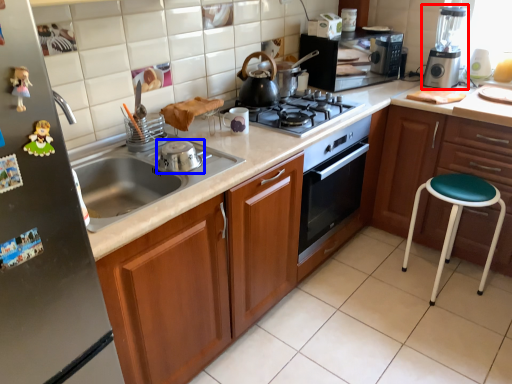
Question: Which of the following is the farthest to the observer, kitchen appliance (highlighted by a red box) or appliance (highlighted by a blue box)?

Choices:
 (A) kitchen appliance
 (B) appliance

Answer: (A)